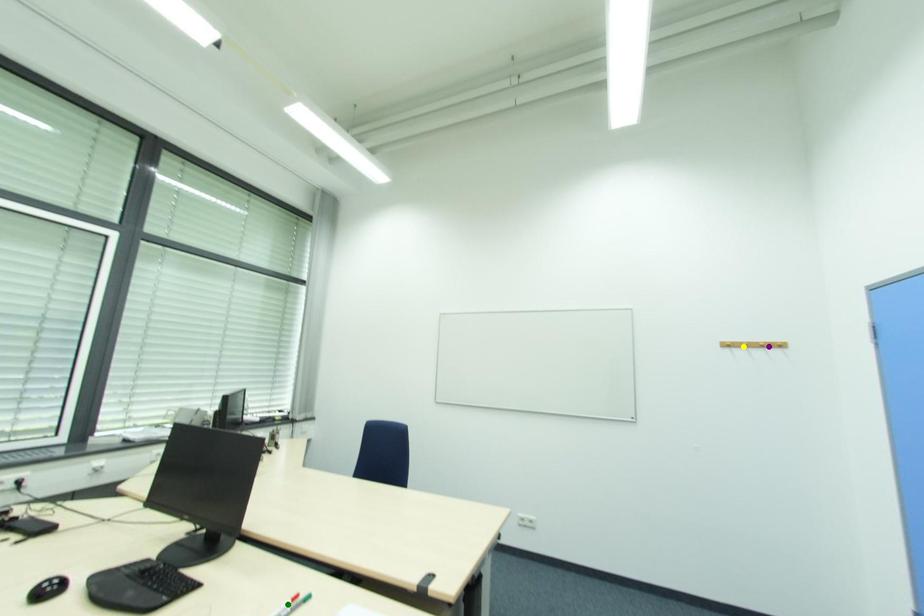
Order these from nearest to farthest:
green point, yellow point, purple point

green point
purple point
yellow point